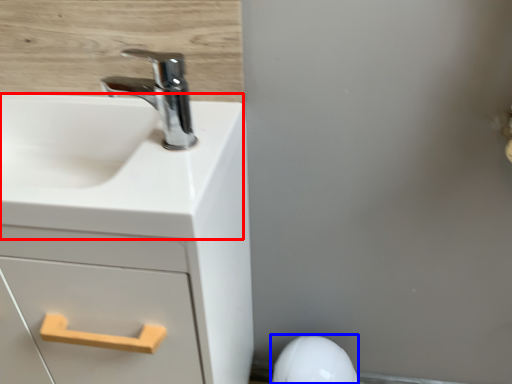
Question: Which object appears farthest to the camera in this image, counter top (highlighted by a red box) or porcelain (highlighted by a blue box)?

Choices:
 (A) counter top
 (B) porcelain

Answer: (B)